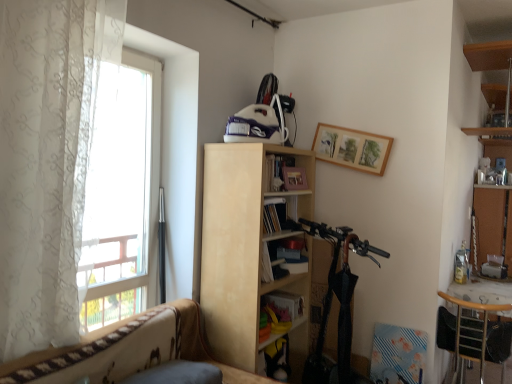
Describe the element at coordinates (246, 250) in the screenshot. I see `light wood bookcase at center` at that location.

Consider the image. What is the approximate height of wooden chair at lower right?

wooden chair at lower right is 28.35 inches tall.

Locate an element on the screen. Image resolution: width=512 pixels, height=384 pixels. patterned fabric couch at lower left is located at coordinates (126, 351).

What do you see at coordinates (126, 351) in the screenshot? I see `patterned fabric couch at lower left` at bounding box center [126, 351].

Identify the location of light wood bookcase at center. The height and width of the screenshot is (384, 512). (246, 250).

Is point (289, 239) positioned before point (295, 294)?

Yes, it is in front of point (295, 294).

Which is more to the left, hardcover book at center, the 1th book in the top-to-bottom sequence, or matte yellow book at center, positioned as the first book in bottom-to-top order?

From the viewer's perspective, matte yellow book at center, positioned as the first book in bottom-to-top order, appears more on the left side.

The width and height of the screenshot is (512, 384). In order to click on book in front of the matte yellow book at center, placed as the second book when sorted from top to bottom in this screenshot , I will do point(282,258).

Which is in front, hardcover book at center, which is the second book from bottom to top, or matte yellow book at center, positioned as the first book in bottom-to-top order?

hardcover book at center, which is the second book from bottom to top, is more forward.

From the picture: Is light wood bookcase at center taller or shorter than wooden chair at lower right?

light wood bookcase at center is taller than wooden chair at lower right.

Is light wood bookcase at center not close to wooden chair at lower right?

That's right, there is a large distance between light wood bookcase at center and wooden chair at lower right.

Is point (208, 179) positioned before point (494, 357)?

Yes, it is in front of point (494, 357).

Where is `bookcase positioned vertically above the wooden chair at lower right (from a real-world perspective)`? The image size is (512, 384). bookcase positioned vertically above the wooden chair at lower right (from a real-world perspective) is located at coordinates (246, 250).

Is wooden chair at lower right completely or partially inside transparent fabric at left?

Actually, wooden chair at lower right is outside transparent fabric at left.

Is transparent fabric at left positioned with its back to wooden chair at lower right?

No, transparent fabric at left is not facing away from wooden chair at lower right.

Is transparent fabric at left directly adjacent to wooden chair at lower right?

No, transparent fabric at left is not with wooden chair at lower right.

Locate an element on the screen. The height and width of the screenshot is (384, 512). window that is above the wooden chair at lower right (from the image's perspective) is located at coordinates (122, 194).

Measure the distance between patterned fabric couch at lower left and white sheer curtain at left.

The distance of patterned fabric couch at lower left from white sheer curtain at left is 24.52 inches.

Which point is more forward, (129,342) or (21,206)?

The point (21,206) is more forward.

From the picture: From a real-world perspective, is patterned fabric couch at lower left over white sheer curtain at left?

No.

Is patterned fabric couch at lower left with white sheer curtain at left?

No, patterned fabric couch at lower left is not touching white sheer curtain at left.

Is wooden chair at lower right bigger than hardcover book at center, which is the second book from bottom to top?

Yes.

How different are the orientations of wooden chair at lower right and hardcover book at center, which is the second book from bottom to top, in degrees?

The angle between the facing direction of wooden chair at lower right and the facing direction of hardcover book at center, which is the second book from bottom to top, is 82.8 degrees.

At what (x,y) coordinates should I click in order to perform the action: click on book that is the 1st object located behind the wooden chair at lower right. Please return your answer as a coordinate pair (x, y). This screenshot has height=384, width=512. Looking at the image, I should click on (282, 258).

Considering the sizes of matte yellow book at center, placed as the second book when sorted from top to bottom, and white sheer curtain at left in the image, is matte yellow book at center, placed as the second book when sorted from top to bottom, bigger or smaller than white sheer curtain at left?

matte yellow book at center, placed as the second book when sorted from top to bottom, is smaller than white sheer curtain at left.

Locate an element on the screen. Image resolution: width=512 pixels, height=384 pixels. book that is the 2nd object located below the white sheer curtain at left (from the image's perspective) is located at coordinates (287, 302).

From the picture: Is matte yellow book at center, placed as the second book when sorted from top to bottom, facing away from white sheer curtain at left?

No, matte yellow book at center, placed as the second book when sorted from top to bottom,'s orientation is not away from white sheer curtain at left.

Are wooden chair at lower right and light wood bookcase at center far apart?

Yes.

Can you confirm if wooden chair at lower right is positioned to the left of light wood bookcase at center?

In fact, wooden chair at lower right is to the right of light wood bookcase at center.

From the picture: Which is in front, wooden chair at lower right or light wood bookcase at center?

Positioned in front is light wood bookcase at center.

Image resolution: width=512 pixels, height=384 pixels. In order to click on book to the right of matte yellow book at center, positioned as the first book in bottom-to-top order in this screenshot , I will do `click(282, 258)`.

Identify the location of bookcase in front of the wooden chair at lower right. (246, 250).

Considering their positions, is transparent fabric at left positioned closer to white sheer curtain at left than wooden chair at lower right?

transparent fabric at left is closer to white sheer curtain at left.

Estimate the real-world distances between objects in this image. Which object is closer to hardcover book at center, the 1th book in the top-to-bottom sequence, wooden chair at lower right or patterned fabric couch at lower left?

patterned fabric couch at lower left.

From the image, which object appears to be farther from patterned fabric couch at lower left, bare wood cabinet at right or light wood bookcase at center?

The object further to patterned fabric couch at lower left is bare wood cabinet at right.

When comparing their distances from bare wood cabinet at right, does white sheer curtain at left or light wood bookcase at center seem closer?

light wood bookcase at center is closer to bare wood cabinet at right.

Considering their positions, is white sheer curtain at left positioned further to wooden picture frame at upper center than light wood bookcase at center?

Among the two, white sheer curtain at left is located further to wooden picture frame at upper center.

Estimate the real-world distances between objects in this image. Which object is further from light wood bookcase at center, white sheer curtain at left or wooden picture frame at upper center?

white sheer curtain at left is positioned further to the anchor light wood bookcase at center.

Looking at the image, which one is located closer to bare wood cabinet at right, matte yellow book at center, placed as the second book when sorted from top to bottom, or wooden chair at lower right?

wooden chair at lower right lies closer to bare wood cabinet at right than the other object.

Considering their positions, is wooden chair at lower right positioned closer to light wood bookcase at center than white sheer curtain at left?

Based on the image, white sheer curtain at left appears to be nearer to light wood bookcase at center.

You are a GUI agent. You are given a task and a screenshot of the screen. Output one action in this format:
    pyautogui.click(x=<x>, y=<y>)
    Task: Click on the picture frame between white sheer curtain at left and hardcover book at center, which is the second book from bottom to top, along the z-axis
    Image resolution: width=512 pixels, height=384 pixels.
    Given the screenshot: What is the action you would take?
    pyautogui.click(x=352, y=148)

Identify the location of curtain positioned between patterned fabric couch at lower left and light wood bookcase at center from near to far. Image resolution: width=512 pixels, height=384 pixels. (47, 160).

I want to click on picture frame between hardcover book at center, the 1th book in the top-to-bottom sequence, and bare wood cabinet at right from left to right, so click(x=352, y=148).

The width and height of the screenshot is (512, 384). In order to click on window between patterned fabric couch at lower left and matte yellow book at center, placed as the second book when sorted from top to bottom, along the z-axis in this screenshot , I will do `click(122, 194)`.